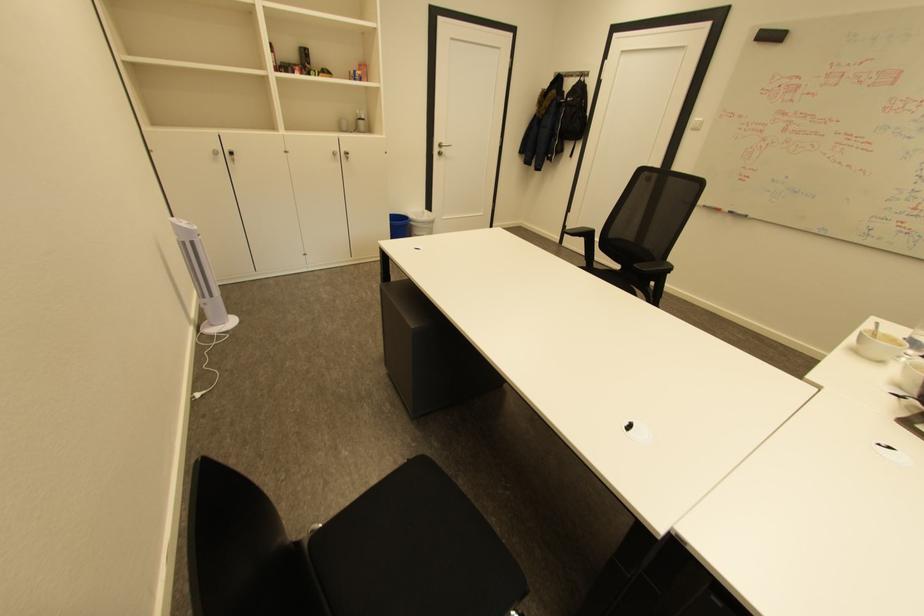
What do you see at coordinates (398, 533) in the screenshot? This screenshot has height=616, width=924. I see `a black chair sitting surface` at bounding box center [398, 533].